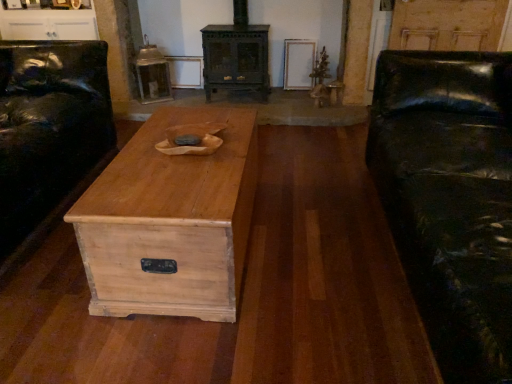
Question: In the image, is natural wood chest at center positioned in front of or behind black leather couch at left?

Choices:
 (A) behind
 (B) front

Answer: (A)

Question: From the image's perspective, is natural wood chest at center above or below black leather couch at left?

Choices:
 (A) below
 (B) above

Answer: (A)

Question: Which of these objects is positioned farthest from the black leather couch at right?

Choices:
 (A) natural wood chest at center
 (B) white glossy cabinet at upper left
 (C) black leather couch at left
 (D) dark green wood stove at center

Answer: (B)

Question: Which object is positioned farthest from the black leather couch at left?

Choices:
 (A) white glossy cabinet at upper left
 (B) natural wood chest at center
 (C) black leather couch at right
 (D) dark green wood stove at center

Answer: (C)